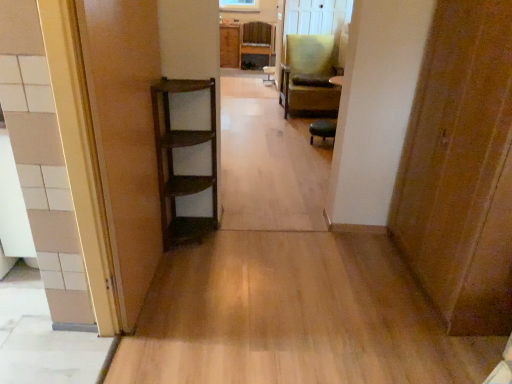
Question: Is wooden door at right, the 2th door viewed from the left, at the back of wooden door at left, the 1th door from the left?

Choices:
 (A) yes
 (B) no

Answer: (B)

Question: From the image's perspective, is wooden door at left, the second door positioned from the right, above wooden door at right, which is the first door in right-to-left order?

Choices:
 (A) yes
 (B) no

Answer: (A)

Question: Is wooden door at left, the second door positioned from the right, completely or partially outside of wooden door at right, which is the first door in right-to-left order?

Choices:
 (A) no
 (B) yes

Answer: (B)

Question: From the image's perspective, would you say wooden door at left, the second door positioned from the right, is shown under wooden door at right, which is the first door in right-to-left order?

Choices:
 (A) yes
 (B) no

Answer: (B)

Question: Does wooden door at left, the second door positioned from the right, have a greater width compared to wooden door at right, the 2th door viewed from the left?

Choices:
 (A) yes
 (B) no

Answer: (B)

Question: From a real-world perspective, is wooden door at left, the second door positioned from the right, above or below green fabric chair at center, the 2th chair in the top-to-bottom sequence?

Choices:
 (A) above
 (B) below

Answer: (A)

Question: Is wooden door at left, the second door positioned from the right, situated inside green fabric chair at center, the 2th chair in the top-to-bottom sequence, or outside?

Choices:
 (A) outside
 (B) inside

Answer: (A)

Question: Considering the positions of wooden door at left, the 1th door from the left, and green fabric chair at center, the 2th chair in the top-to-bottom sequence, in the image, is wooden door at left, the 1th door from the left, wider or thinner than green fabric chair at center, the 2th chair in the top-to-bottom sequence,?

Choices:
 (A) wide
 (B) thin

Answer: (B)

Question: From the image's perspective, relative to green fabric chair at center, the first chair from the right, is wooden door at left, the second door positioned from the right, above or below?

Choices:
 (A) above
 (B) below

Answer: (B)

Question: Is point (239, 44) closer or farther from the camera than point (230, 54)?

Choices:
 (A) farther
 (B) closer

Answer: (B)

Question: Looking at the image, does wooden chair at center, which is the 1th chair from back to front, seem bigger or smaller compared to wooden cabinet at center?

Choices:
 (A) big
 (B) small

Answer: (A)

Question: Is wooden chair at center, arranged as the first chair when viewed from the top, in front of or behind wooden cabinet at center in the image?

Choices:
 (A) front
 (B) behind

Answer: (A)

Question: Do you think wooden chair at center, which appears as the second chair when ordered from the bottom, is within wooden cabinet at center, or outside of it?

Choices:
 (A) outside
 (B) inside

Answer: (A)

Question: Do you think wooden chair at center, which appears as the second chair when ordered from the bottom, is within wooden door at left, the second door positioned from the right, or outside of it?

Choices:
 (A) inside
 (B) outside

Answer: (B)

Question: In terms of size, does wooden chair at center, positioned as the second chair in right-to-left order, appear bigger or smaller than wooden door at left, the 1th door from the left?

Choices:
 (A) small
 (B) big

Answer: (B)